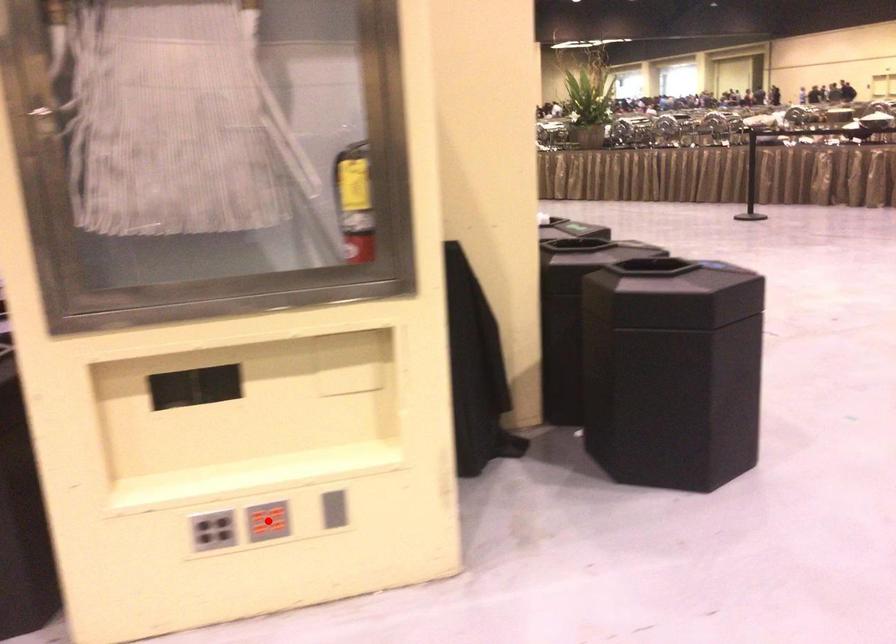
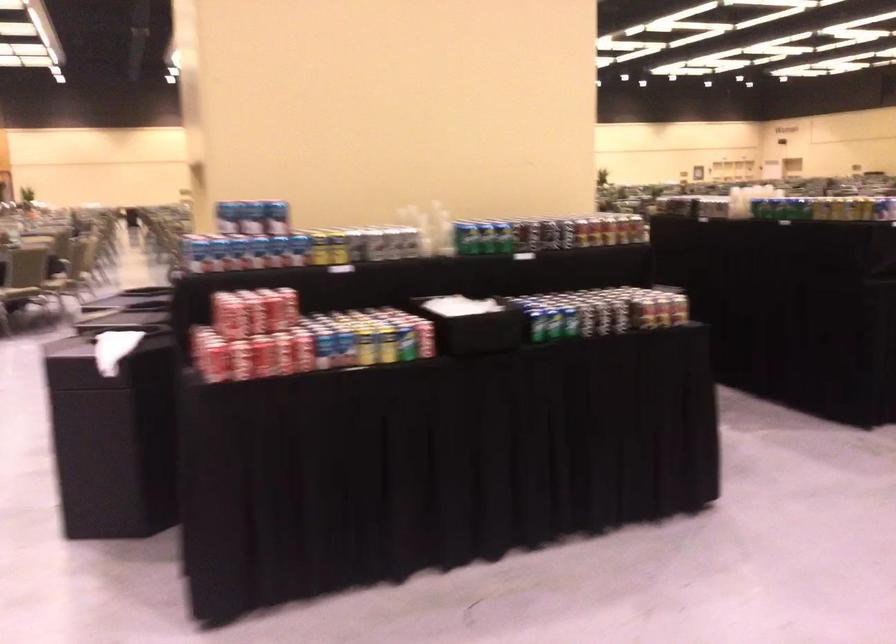
Question: I am providing you with two images of the same scene from different viewpoints. A red point is marked on the first image. Can you still see the location of the red point in image 2?

Choices:
 (A) Yes
 (B) No

Answer: (B)